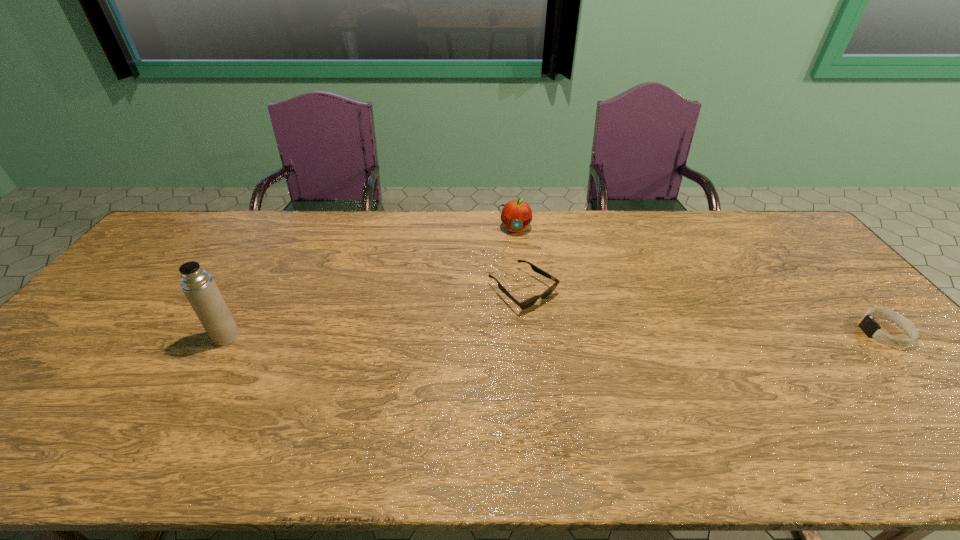
Find the location of a particular element. blank space located 0.210m on the surface of the third shortest object is located at coordinates (515, 278).

This screenshot has height=540, width=960. Identify the location of free space located 0.160m on the surface of the third shortest object. (515, 267).

Locate an element on the screen. blank space located 0.370m on the surface of the third shortest object is located at coordinates click(515, 315).

This screenshot has width=960, height=540. I want to click on free location located on the front-facing side of the sunglasses, so [x=662, y=403].

Find the location of a particular element. Image resolution: width=960 pixels, height=540 pixels. vacant space located on the front-facing side of the sunglasses is located at coordinates (568, 327).

The image size is (960, 540). Find the location of `free region located on the front-facing side of the sunglasses`. free region located on the front-facing side of the sunglasses is located at coordinates (644, 388).

I want to click on object present at the far edge, so point(516,214).

This screenshot has height=540, width=960. I want to click on object that is at the right edge, so click(868, 325).

Identify the location of vacant space at the far edge. [x=677, y=248].

Find the location of a particular element. The height and width of the screenshot is (540, 960). vacant region at the near edge of the desktop is located at coordinates (537, 413).